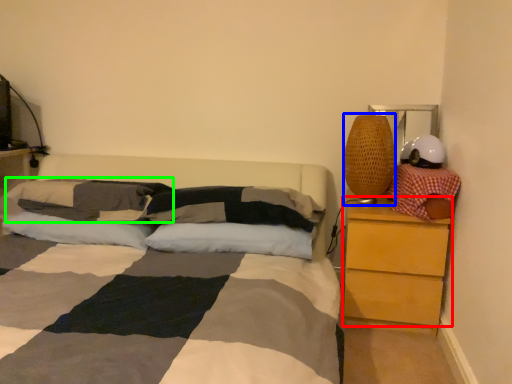
Question: Estimate the real-world distances between objects in this image. Which object is closer to chest of drawers (highlighted by a red box), table lamp (highlighted by a blue box) or pillow (highlighted by a green box)?

Choices:
 (A) table lamp
 (B) pillow

Answer: (A)